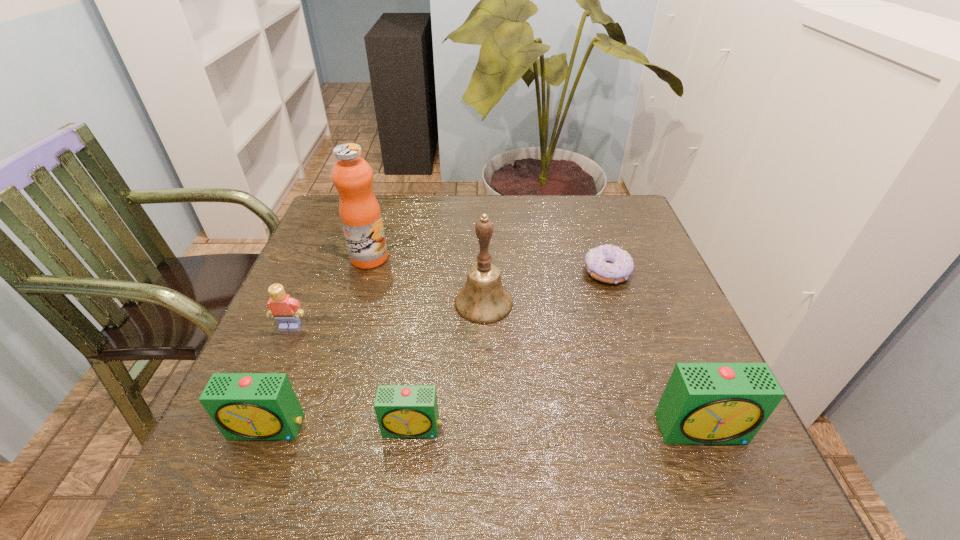
Identify the location of free space located 0.280m on the back of the shortest object. (583, 200).

Where is `vacant point located on the right of the tallest object`? vacant point located on the right of the tallest object is located at coordinates (458, 258).

This screenshot has height=540, width=960. In order to click on vacant region located on the front-facing side of the Lego in this screenshot , I will do click(x=262, y=392).

You are a GUI agent. You are given a task and a screenshot of the screen. Output one action in this format:
    pyautogui.click(x=<x>, y=<y>)
    Task: Click on the vacant space located on the right of the fifth object from left to right
    The image size is (960, 540).
    Given the screenshot: What is the action you would take?
    pyautogui.click(x=622, y=303)

Locate an element on the screen. alarm clock that is at the left edge is located at coordinates (244, 406).

The width and height of the screenshot is (960, 540). What are the coordinates of `fruit juice that is at the left edge` in the screenshot? It's located at (360, 215).

Image resolution: width=960 pixels, height=540 pixels. In order to click on Lego that is at the left edge in this screenshot , I will do `click(286, 310)`.

Locate an element on the screen. The image size is (960, 540). alarm clock that is at the right edge is located at coordinates (703, 403).

The width and height of the screenshot is (960, 540). I want to click on doughnut that is at the right edge, so click(x=607, y=263).

Locate an element on the screen. The width and height of the screenshot is (960, 540). object situated at the near left corner is located at coordinates (244, 406).